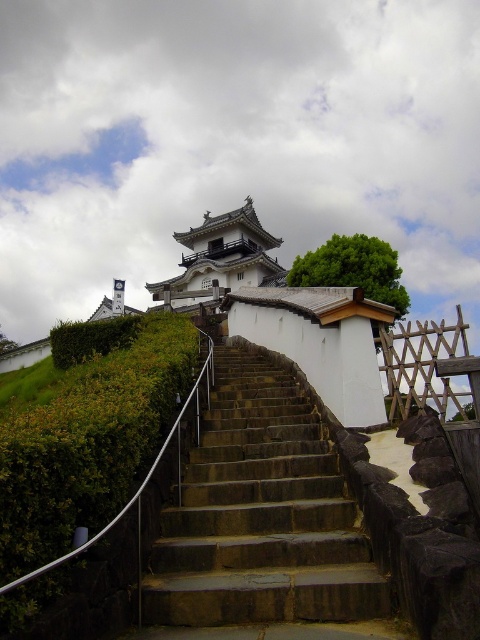
Question: Which of the following is the closest to the observer?

Choices:
 (A) (173, 332)
 (B) (219, 221)
 (C) (76, 339)

Answer: (A)

Question: Is green leafy hedge at lower left below green leafy hedge at upper left?

Choices:
 (A) yes
 (B) no

Answer: (A)

Question: Does stone stairs at center come behind white stone temple at upper center?

Choices:
 (A) yes
 (B) no

Answer: (B)

Question: Estimate the real-world distances between objects in this image. Which object is farther from the stone stairs at center?

Choices:
 (A) green leafy hedge at lower left
 (B) white stone temple at upper center
 (C) green leafy hedge at upper left

Answer: (B)

Question: Which object appears farthest from the camera in this image?

Choices:
 (A) stone stairs at center
 (B) green leafy hedge at lower left
 (C) white stone temple at upper center

Answer: (C)

Question: Is stone stairs at center further to camera compared to green leafy hedge at upper left?

Choices:
 (A) no
 (B) yes

Answer: (A)